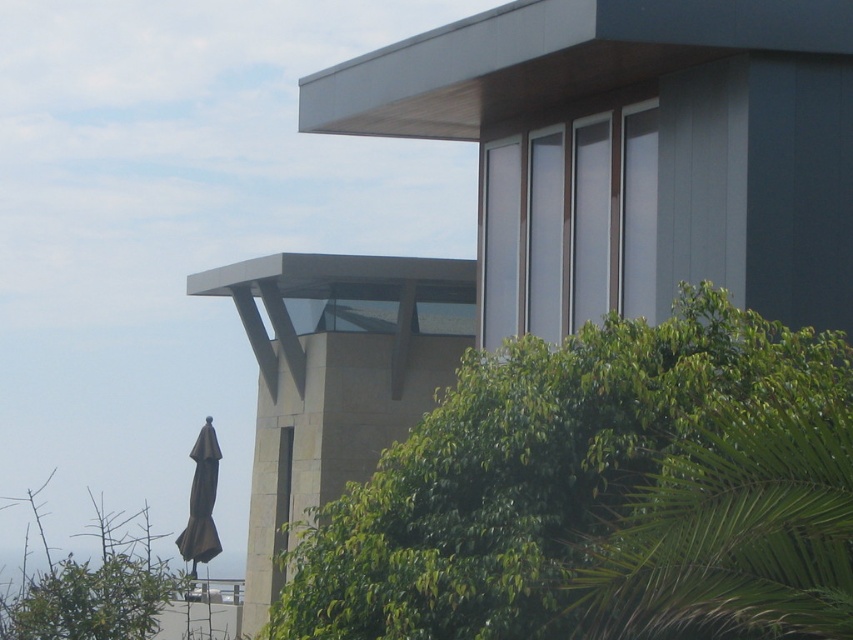
Between point (717, 500) and point (192, 486), which one is positioned in front?

Point (717, 500) is in front.

Does green leafy palm tree at lower right have a greater width compared to brown matte umbrella at lower left?

Indeed, green leafy palm tree at lower right has a greater width compared to brown matte umbrella at lower left.

Find the location of a particular element. green leafy palm tree at lower right is located at coordinates (733, 529).

Which is below, green leafy tree at center or brown matte umbrella at lower left?

brown matte umbrella at lower left is lower down.

Is green leafy tree at center behind brown matte umbrella at lower left?

No, green leafy tree at center is closer to the viewer.

Does point (341, 596) come in front of point (202, 541)?

Yes.

Where is `green leafy tree at center`? This screenshot has width=853, height=640. green leafy tree at center is located at coordinates (602, 493).

What do you see at coordinates (602, 493) in the screenshot? I see `green leafy tree at center` at bounding box center [602, 493].

Does point (563, 634) lie behind point (822, 588)?

Yes.

The image size is (853, 640). In order to click on green leafy tree at center in this screenshot , I will do `click(602, 493)`.